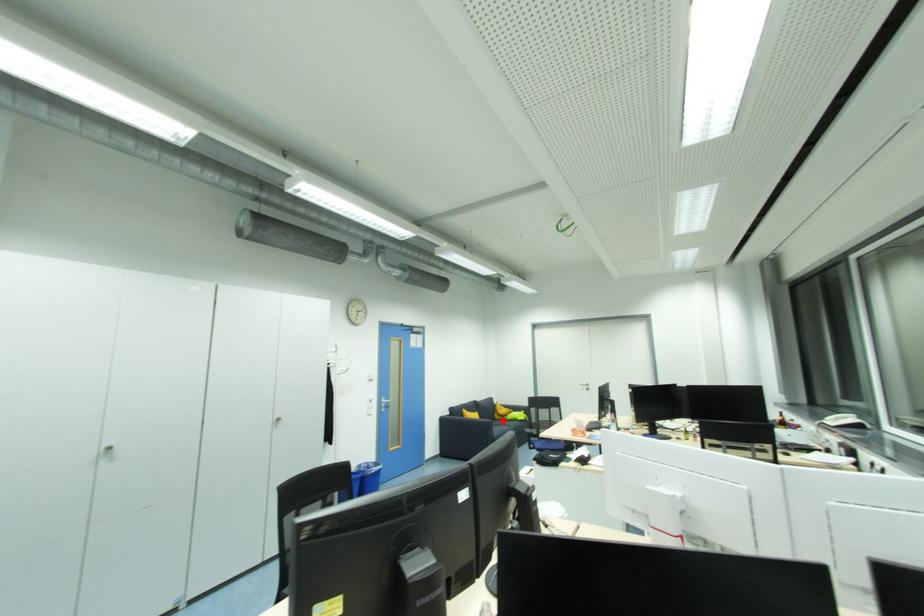
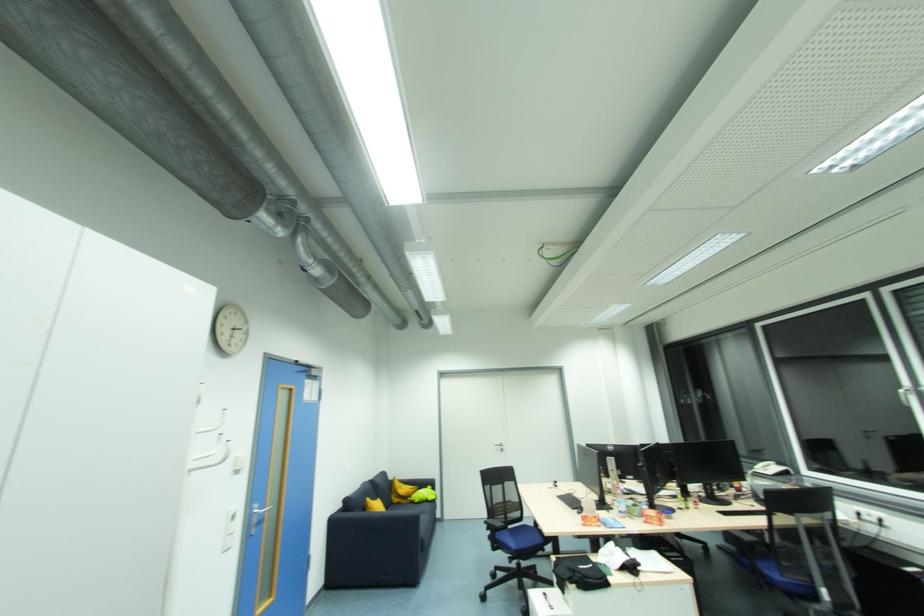
In the second image, find the point that corresponds to the highlighted location in the first image.

(400, 505)